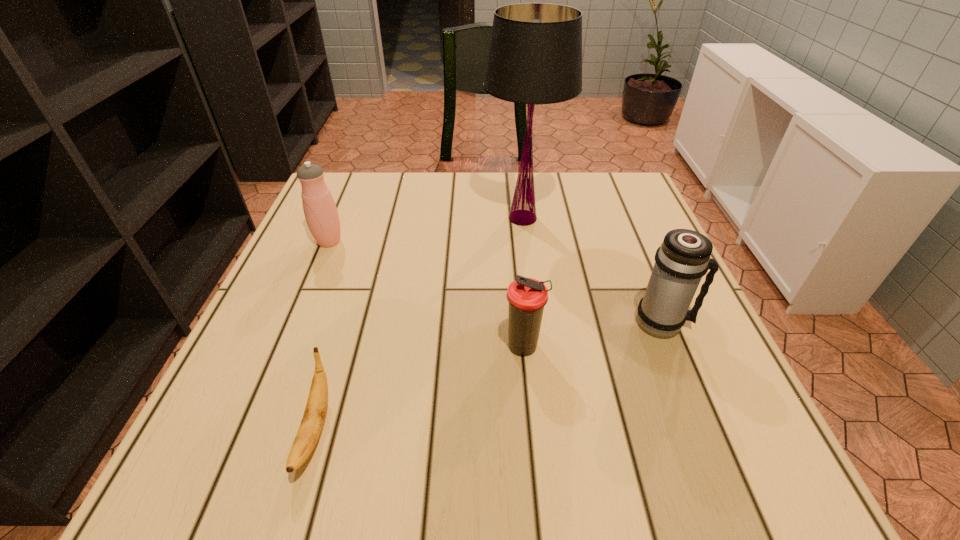
Locate an element on the screen. Image resolution: width=960 pixels, height=540 pixels. vacant position located 0.220m on the front-facing side of the lampshade is located at coordinates (396, 218).

This screenshot has width=960, height=540. What are the coordinates of `free space located on the right of the leftmost thermos bottle` in the screenshot? It's located at (491, 241).

Locate an element on the screen. The width and height of the screenshot is (960, 540). blank area located 0.140m on the front of the second thermos bottle from left to right is located at coordinates pos(532,438).

Where is `object positioned at the far edge`? object positioned at the far edge is located at coordinates (535, 55).

Identify the location of object at the near edge. This screenshot has height=540, width=960. (311, 425).

Where is `thermos bottle present at the left edge`? This screenshot has height=540, width=960. thermos bottle present at the left edge is located at coordinates (320, 210).

You are a GUI agent. You are given a task and a screenshot of the screen. Output one action in this format:
    pyautogui.click(x=<x>, y=<y>)
    Task: Click on the banana present at the left edge
    This screenshot has width=960, height=540.
    Given the screenshot: What is the action you would take?
    pyautogui.click(x=311, y=425)

Find the location of `object that is positioned at the right edge`. object that is positioned at the right edge is located at coordinates (683, 258).

You are a GUI agent. You are given a task and a screenshot of the screen. Output one action in this format:
    pyautogui.click(x=<x>, y=<y>)
    Task: Click on the object that is at the near left corner
    The image size is (960, 540).
    Given the screenshot: What is the action you would take?
    pyautogui.click(x=311, y=425)

Locate an element on the screen. The height and width of the screenshot is (540, 960). vacant region at the far edge is located at coordinates [x=575, y=179].